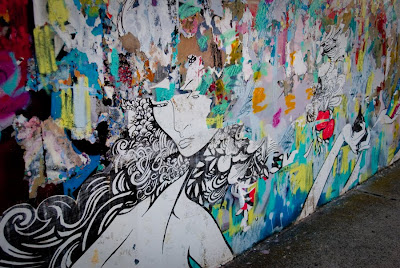
This screenshot has width=400, height=268. I want to click on orange paint, so click(259, 91), click(290, 99), click(310, 94).